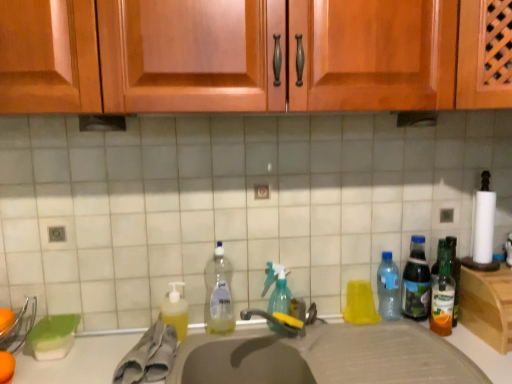
Locate an element on the screen. free point above green glass bottle at right (from a real-world perspective) is located at coordinates (490, 268).